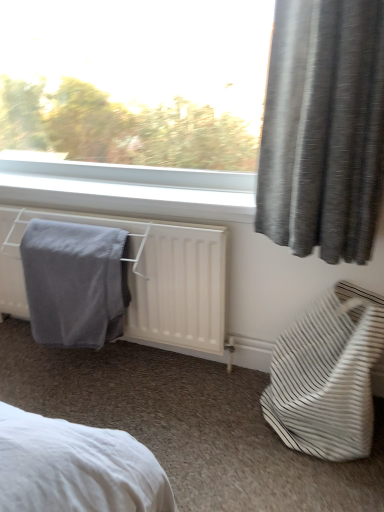
Where is `gray soft towel at lower left`? The height and width of the screenshot is (512, 384). gray soft towel at lower left is located at coordinates (75, 283).

Find the location of a particular element. The image size is (384, 512). white striped fabric bag at lower right is located at coordinates (327, 376).

Identify the location of gray soft towel at lower left. (75, 283).

In terms of height, does gray soft towel at lower left look taller or shorter compared to white matte radiator at lower left?

gray soft towel at lower left is taller than white matte radiator at lower left.

Is white matte radiator at lower left inside gray soft towel at lower left?

Yes, white matte radiator at lower left is inside gray soft towel at lower left.

Does gray soft towel at lower left turn towards white matte radiator at lower left?

Yes, gray soft towel at lower left is aimed at white matte radiator at lower left.

Would you say gray soft towel at lower left is to the left or to the right of white matte radiator at lower left in the picture?

gray soft towel at lower left is positioned on white matte radiator at lower left's left side.

Does point (323, 374) come behind point (64, 269)?

No, (323, 374) is in front of (64, 269).

From the image's perspective, between white striped fabric bag at lower right and gray soft towel at lower left, which one is located above?

gray soft towel at lower left, from the image's perspective.

Is white striped fabric bag at lower right touching gray soft towel at lower left?

No, white striped fabric bag at lower right is not with gray soft towel at lower left.

Is white striped fabric bag at lower right inside the boundaries of gray soft towel at lower left, or outside?

The correct answer is: outside.

Which is in front, point (197, 229) or point (346, 207)?

The point (346, 207) is more forward.

What's the angular difference between white matte radiator at lower left and gray textured curtain at upper right's facing directions?

0.705 degrees separate the facing orientations of white matte radiator at lower left and gray textured curtain at upper right.

From the image's perspective, is white matte radiator at lower left above gray textured curtain at upper right?

No, from the image's perspective, white matte radiator at lower left is not on top of gray textured curtain at upper right.

Is the position of white matte radiator at lower left less distant than that of gray textured curtain at upper right?

No, white matte radiator at lower left is further to the viewer.

Considering the relative sizes of gray soft towel at lower left and white striped fabric bag at lower right in the image provided, is gray soft towel at lower left bigger than white striped fabric bag at lower right?

No.

Which is correct: gray soft towel at lower left is inside white striped fabric bag at lower right, or outside of it?

gray soft towel at lower left is not inside white striped fabric bag at lower right, it's outside.

Looking at this image, considering the relative sizes of gray soft towel at lower left and white striped fabric bag at lower right in the image provided, is gray soft towel at lower left shorter than white striped fabric bag at lower right?

No, gray soft towel at lower left is not shorter than white striped fabric bag at lower right.

Considering the sizes of gray soft towel at lower left and white striped fabric bag at lower right in the image, is gray soft towel at lower left wider or thinner than white striped fabric bag at lower right?

Clearly, gray soft towel at lower left has less width compared to white striped fabric bag at lower right.

Looking at this image, which of these two, gray textured curtain at upper right or white striped fabric bag at lower right, is smaller?

With smaller size is gray textured curtain at upper right.

Considering the sizes of objects gray textured curtain at upper right and white striped fabric bag at lower right in the image provided, who is shorter, gray textured curtain at upper right or white striped fabric bag at lower right?

white striped fabric bag at lower right.

Is point (278, 194) farther from viewer compared to point (271, 408)?

No, (278, 194) is closer to viewer.

Could white striped fabric bag at lower right be considered to be inside gray textured curtain at upper right?

No, white striped fabric bag at lower right is located outside of gray textured curtain at upper right.

Is white matte radiator at lower left smaller than gray soft towel at lower left?

No, white matte radiator at lower left is not smaller than gray soft towel at lower left.

In terms of width, does white matte radiator at lower left look wider or thinner when compared to gray soft towel at lower left?

Clearly, white matte radiator at lower left has more width compared to gray soft towel at lower left.

This screenshot has width=384, height=512. Identify the location of bath towel on the left of white matte radiator at lower left. (75, 283).

Is white matte radiator at lower left inside the boundaries of gray soft towel at lower left, or outside?

white matte radiator at lower left can be found inside gray soft towel at lower left.

Is white striped fabric bag at lower right wider or thinner than white matte radiator at lower left?

Clearly, white striped fabric bag at lower right has more width compared to white matte radiator at lower left.

Could you tell me if white striped fabric bag at lower right is facing white matte radiator at lower left?

No, white striped fabric bag at lower right is not facing towards white matte radiator at lower left.

Are white striped fabric bag at lower right and white matte radiator at lower left making contact?

white striped fabric bag at lower right is not next to white matte radiator at lower left, and they're not touching.

Which object is positioned more to the right, white striped fabric bag at lower right or white matte radiator at lower left?

white striped fabric bag at lower right.

You are a GUI agent. You are given a task and a screenshot of the screen. Output one action in this format:
    pyautogui.click(x=<x>, y=<y>)
    Task: Click on the bath towel below the white matte radiator at lower left (from a real-world perspective)
    Image resolution: width=384 pixels, height=512 pixels.
    Given the screenshot: What is the action you would take?
    pyautogui.click(x=75, y=283)

You are a GUI agent. You are given a task and a screenshot of the screen. Output one action in this format:
    pyautogui.click(x=<x>, y=<y>)
    Task: Click on the bath towel positioned vertically above the white striped fabric bag at lower right (from a real-world perspective)
    The width and height of the screenshot is (384, 512).
    Given the screenshot: What is the action you would take?
    pyautogui.click(x=75, y=283)

Looking at the image, which one is located closer to white striped fabric bag at lower right, gray soft towel at lower left or white matte radiator at lower left?

Among the two, white matte radiator at lower left is located nearer to white striped fabric bag at lower right.

Looking at the image, which one is located further to white matte radiator at lower left, gray soft towel at lower left or gray textured curtain at upper right?

gray textured curtain at upper right lies further to white matte radiator at lower left than the other object.

Which object lies further to the anchor point white matte radiator at lower left, gray soft towel at lower left or white striped fabric bag at lower right?

white striped fabric bag at lower right is further to white matte radiator at lower left.

When comparing their distances from white matte radiator at lower left, does gray textured curtain at upper right or gray soft towel at lower left seem closer?

gray soft towel at lower left is positioned closer to the anchor white matte radiator at lower left.

From the picture: Which object lies nearer to the anchor point gray soft towel at lower left, white matte radiator at lower left or white striped fabric bag at lower right?

white matte radiator at lower left lies closer to gray soft towel at lower left than the other object.

Which object lies further to the anchor point gray soft towel at lower left, white matte radiator at lower left or gray textured curtain at upper right?

gray textured curtain at upper right is further to gray soft towel at lower left.

When comparing their distances from white matte radiator at lower left, does white striped fabric bag at lower right or gray soft towel at lower left seem closer?

gray soft towel at lower left lies closer to white matte radiator at lower left than the other object.

Looking at the image, which one is located further to white striped fabric bag at lower right, white matte radiator at lower left or gray soft towel at lower left?

gray soft towel at lower left is further to white striped fabric bag at lower right.

Where is `curtain between white matte radiator at lower left and white striped fabric bag at lower right from left to right`? This screenshot has width=384, height=512. curtain between white matte radiator at lower left and white striped fabric bag at lower right from left to right is located at coordinates (x=323, y=129).

Locate an element on the screen. radiator between gray soft towel at lower left and gray textured curtain at upper right in the horizontal direction is located at coordinates (143, 277).

At what (x,y) coordinates should I click in order to perform the action: click on radiator located between gray soft towel at lower left and white striped fabric bag at lower right in the left-right direction. Please return your answer as a coordinate pair (x, y). The width and height of the screenshot is (384, 512). Looking at the image, I should click on (143, 277).

Identify the location of curtain between gray soft towel at lower left and white striped fabric bag at lower right in the horizontal direction. (323, 129).